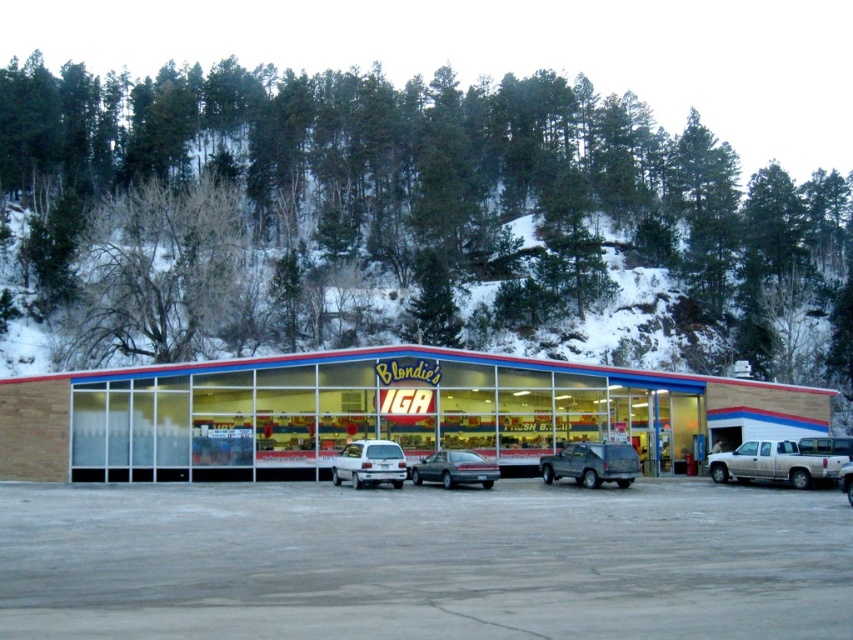
Question: Which point is closer to the camera taking this photo?

Choices:
 (A) (213, 605)
 (B) (583, 470)
 (C) (793, 461)

Answer: (A)

Question: Can you confirm if wooden siding building at center is thinner than white matte truck at right?

Choices:
 (A) yes
 (B) no

Answer: (B)

Question: Is matte gray suv at center closer to the viewer compared to green matte sedan at center?

Choices:
 (A) no
 (B) yes

Answer: (B)

Question: Which of these objects is positioned closest to the silver metallic truck at center?

Choices:
 (A) white matte hatchback at center
 (B) wooden siding building at center
 (C) white matte truck at right

Answer: (C)

Question: Can you confirm if white matte hatchback at center is positioned below green matte sedan at center?

Choices:
 (A) no
 (B) yes

Answer: (A)

Question: Based on their relative distances, which object is nearer to the green matte sedan at center?

Choices:
 (A) matte gray suv at center
 (B) gray concrete parking lot at center

Answer: (A)